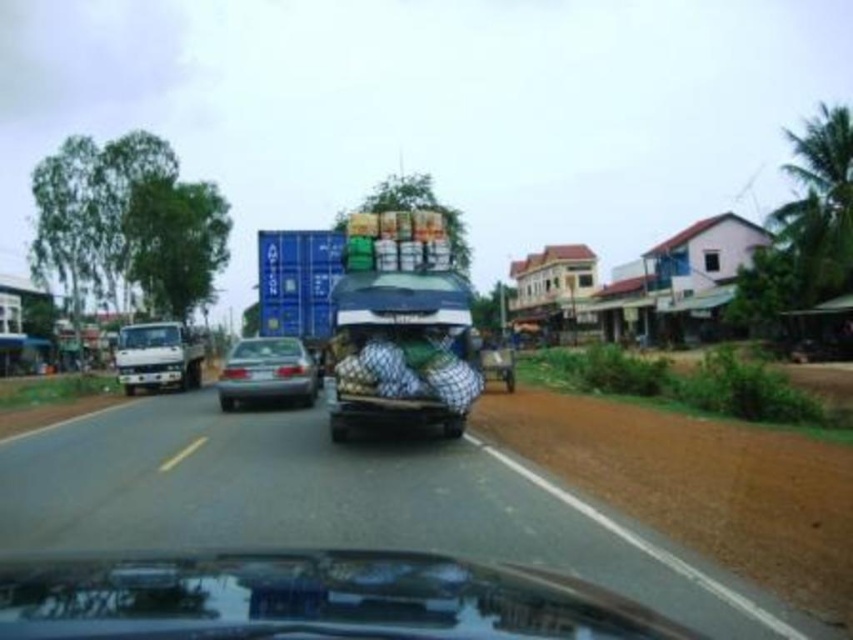
Does satin silver sedan at center appear under wooden cart at center?

Yes, satin silver sedan at center is below wooden cart at center.

The image size is (853, 640). In order to click on satin silver sedan at center in this screenshot , I will do `click(267, 372)`.

You are a GUI agent. You are given a task and a screenshot of the screen. Output one action in this format:
    pyautogui.click(x=<x>, y=<y>)
    Task: Click on the satin silver sedan at center
    The height and width of the screenshot is (640, 853).
    Given the screenshot: What is the action you would take?
    pyautogui.click(x=267, y=372)

Is point (264, 380) farther from camera compared to point (138, 360)?

No, it is not.

Which is in front, point (286, 344) or point (120, 358)?

Point (286, 344)

Identify the location of satin silver sedan at center. This screenshot has width=853, height=640. (267, 372).

What do you see at coordinates (157, 356) in the screenshot? This screenshot has height=640, width=853. I see `white matte truck at left` at bounding box center [157, 356].

The image size is (853, 640). I want to click on white matte truck at left, so click(x=157, y=356).

Between point (158, 381) and point (485, 355), which one is positioned in front?

Point (485, 355)

Image resolution: width=853 pixels, height=640 pixels. I want to click on white matte truck at left, so pos(157,356).